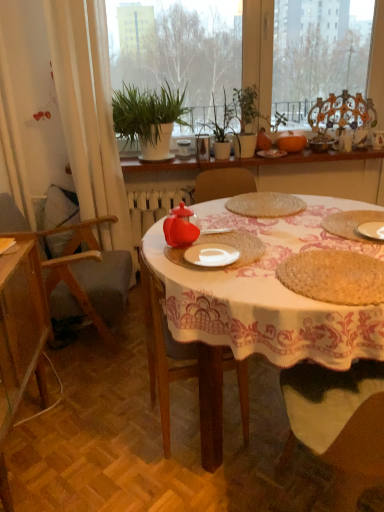
Locate an element on the screen. Image resolution: width=384 pixels, height=512 pixels. free location above transparent glass chair at upper right, which is the 3th chair from front to back (from a real-world perspective) is located at coordinates (351, 89).